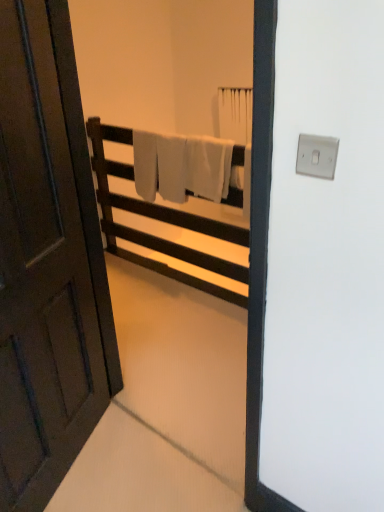
Question: From their relative heights in the image, would you say white soft towel at center is taller or shorter than dark wood door at left?

Choices:
 (A) tall
 (B) short

Answer: (B)

Question: Is white soft towel at center to the left or to the right of dark wood door at left in the image?

Choices:
 (A) right
 (B) left

Answer: (A)

Question: Based on their relative distances, which object is nearer to the white matte towel rack at center?

Choices:
 (A) dark wood door at left
 (B) white soft towel at center

Answer: (B)

Question: Which of these objects is positioned closest to the dark wood door at left?

Choices:
 (A) white matte towel rack at center
 (B) white soft towel at center

Answer: (B)